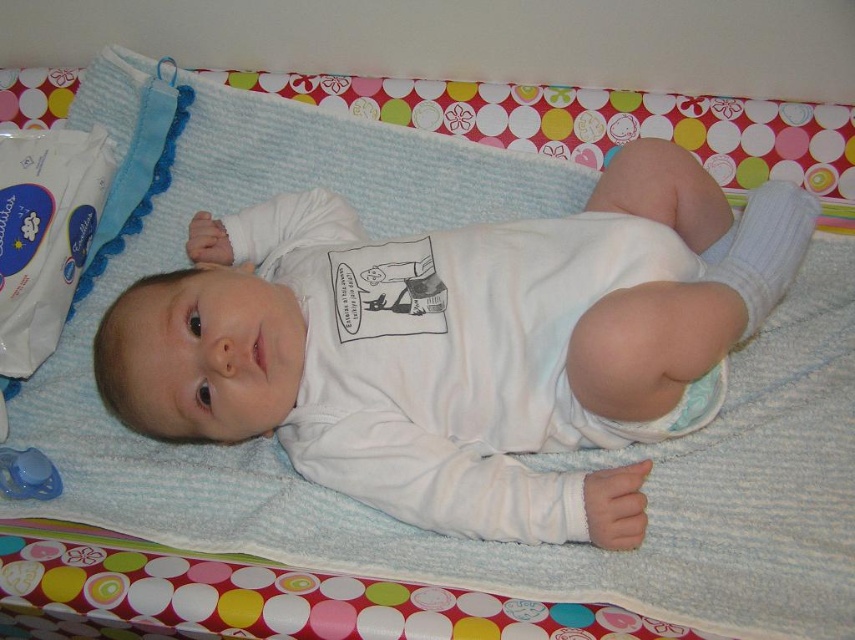
You are a caregiver trying to reach the blue plastic pacifier at lower left while the white soft baby at center is on the changing table. Which direction should you move to get the pacifier?

The white soft baby at center is to the right of the blue plastic pacifier at lower left, so you should move to your left to reach the blue plastic pacifier at lower left.

You are a caregiver preparing to change the baby. You need to place the white cloth diaper at center and the blue plastic pacifier at lower left in a drawer. The drawer can only hold items that are smaller than 15 cm in length. Based on their sizes, which item will fit in the drawer?

The blue plastic pacifier at lower left is smaller than the white cloth diaper at center. Since the drawer can only hold items smaller than 15 cm, the blue plastic pacifier at lower left will fit in the drawer, but the white cloth diaper at center might be too large.